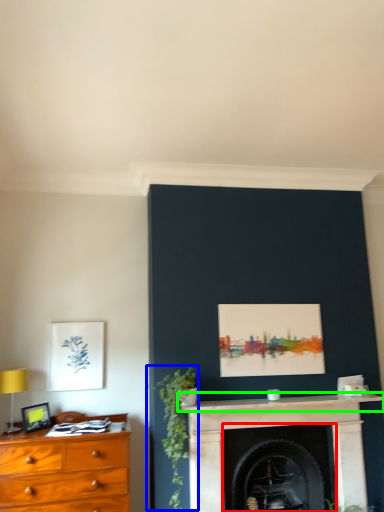
Question: Which object is the farthest from fireplace (highlighted by a red box)? Choose among these: plant (highlighted by a blue box) or mantle (highlighted by a green box).

Choices:
 (A) plant
 (B) mantle

Answer: (A)